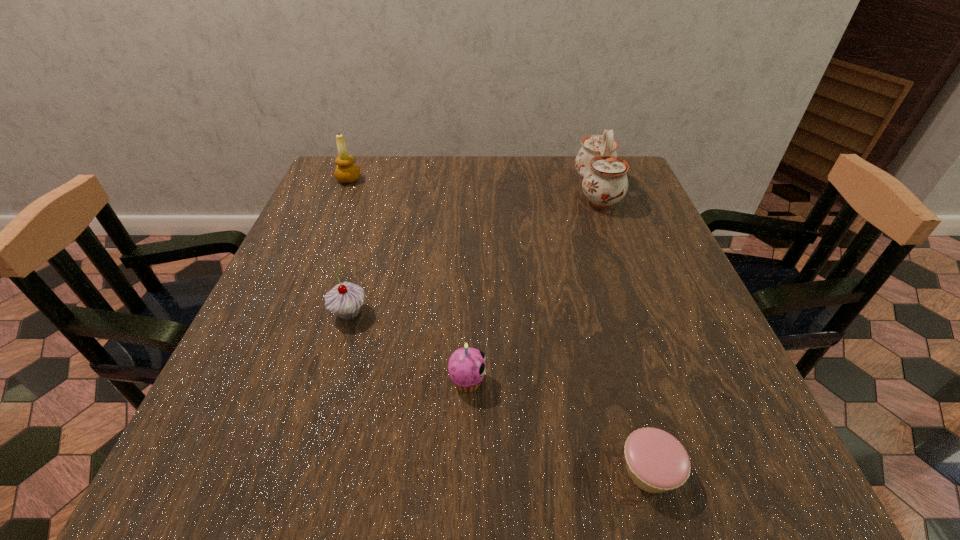
At what (x,y) coordinates should I click in order to perform the action: click on vacant space that satisfies the following two spatial constraints: 1. on the face of the third object from left to right; 2. on the right side of the shortest object. Please return your answer as a coordinate pair (x, y). The width and height of the screenshot is (960, 540). Looking at the image, I should click on (466, 471).

This screenshot has width=960, height=540. I want to click on vacant space that satisfies the following two spatial constraints: 1. on the back side of the shortest object; 2. on the face of the fourth farthest object, so click(x=624, y=381).